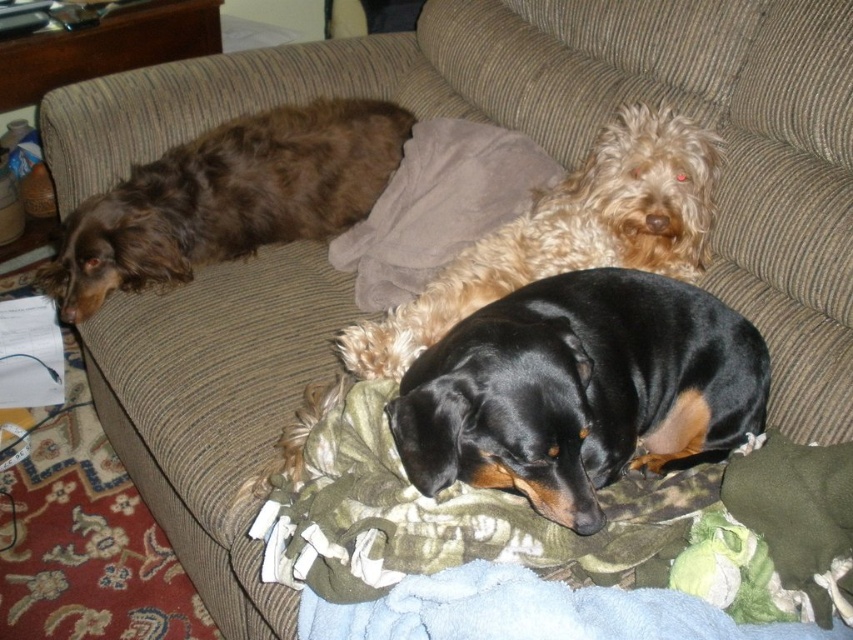
Can you confirm if camouflage fabric blanket at lower center is shorter than brown shaggy dog at left?

Yes, camouflage fabric blanket at lower center is shorter than brown shaggy dog at left.

Is camouflage fabric blanket at lower center further to the viewer compared to brown shaggy dog at left?

No.

Who is more distant from viewer, (564, 547) or (254, 154)?

The point (254, 154) is more distant.

The width and height of the screenshot is (853, 640). I want to click on camouflage fabric blanket at lower center, so click(556, 524).

Does camouflage fabric blanket at lower center have a smaller size compared to shiny black coat at center?

Correct, camouflage fabric blanket at lower center occupies less space than shiny black coat at center.

Is camouflage fabric blanket at lower center taller than shiny black coat at center?

Incorrect, camouflage fabric blanket at lower center's height is not larger of shiny black coat at center's.

Does point (328, 573) come closer to viewer compared to point (619, 253)?

Yes, point (328, 573) is closer to viewer.

The height and width of the screenshot is (640, 853). In order to click on camouflage fabric blanket at lower center in this screenshot , I will do `click(556, 524)`.

Consider the image. Is black smooth dachshund at center bigger than shiny black coat at center?

Incorrect, black smooth dachshund at center is not larger than shiny black coat at center.

You are a GUI agent. You are given a task and a screenshot of the screen. Output one action in this format:
    pyautogui.click(x=<x>, y=<y>)
    Task: Click on the black smooth dachshund at center
    
    Given the screenshot: What is the action you would take?
    pyautogui.click(x=579, y=390)